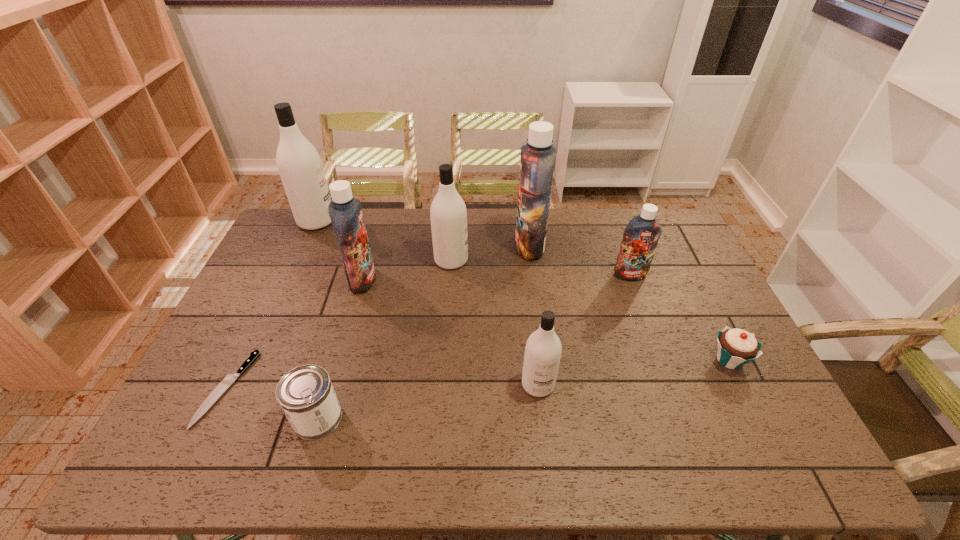
Locate an element on the screen. The image size is (960, 540). the nearest white shampoo is located at coordinates (543, 349).

Where is `the rightmost white shampoo`? The height and width of the screenshot is (540, 960). the rightmost white shampoo is located at coordinates (543, 349).

Find the location of a particular element. The height and width of the screenshot is (540, 960). can is located at coordinates (306, 395).

Image resolution: width=960 pixels, height=540 pixels. Find the location of `teal cupcake`. teal cupcake is located at coordinates (736, 347).

Where is `the rightmost object`? This screenshot has height=540, width=960. the rightmost object is located at coordinates point(736,347).

Where is `steak knife`? steak knife is located at coordinates (229, 378).

In order to click on vacant space located 0.240m on the front-facing side of the biggest white shampoo in this screenshot , I will do `click(398, 221)`.

Image resolution: width=960 pixels, height=540 pixels. What are the coordinates of `vacant region located on the front label of the second blue shampoo from left to right` in the screenshot? It's located at (428, 246).

I want to click on vacant space located on the front label of the second blue shampoo from left to right, so click(415, 246).

I want to click on vacant region located on the front label of the second blue shampoo from left to right, so click(x=459, y=246).